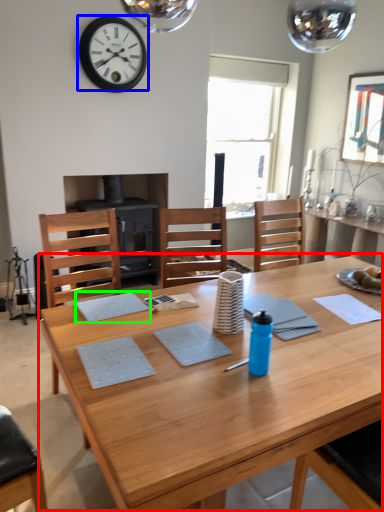
Question: Which object is positioned farthest from table (highlighted by a red box)? Select from wall clock (highlighted by a blue box) and place mat (highlighted by a green box).

Choices:
 (A) wall clock
 (B) place mat

Answer: (A)